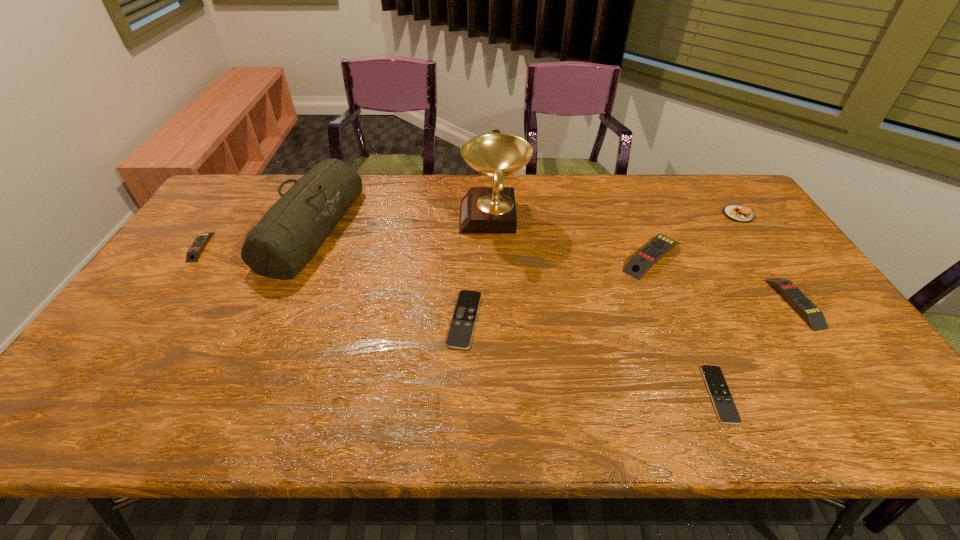
Find the location of `the farther black remote control`. the farther black remote control is located at coordinates [x=460, y=333].

Identify the location of the seventh tallest object. Image resolution: width=960 pixels, height=540 pixels. (460, 333).

Identify the location of the right black remote control. (726, 410).

This screenshot has width=960, height=540. I want to click on the shortest object, so click(726, 410).

Find the location of a particular element. Image resolution: width=960 pixels, height=540 pixels. vacant space located 0.100m on the front-facing side of the tallest object is located at coordinates (430, 217).

At what (x,y) coordinates should I click in order to perform the action: click on vacant space located on the front-facing side of the tallest object. Please return your answer as a coordinate pair (x, y). The width and height of the screenshot is (960, 540). Looking at the image, I should click on (439, 217).

Locate an element on the screen. Image resolution: width=960 pixels, height=540 pixels. vacant space located on the front-facing side of the tallest object is located at coordinates (366, 217).

You are a GUI agent. You are given a task and a screenshot of the screen. Output one action in this format:
    pyautogui.click(x=<x>, y=<y>)
    Task: Click on the free space located on the right of the olive duffel bag
    Image resolution: width=960 pixels, height=540 pixels.
    Given the screenshot: What is the action you would take?
    pyautogui.click(x=368, y=228)

In order to click on vacant space situated 0.260m on the front of the third tallest object in this screenshot , I will do `click(784, 279)`.

At what (x,y) coordinates should I click in order to perform the action: click on vacant space situated 0.190m on the back of the biggest yellow remote control. Please return your answer as a coordinate pair (x, y). The width and height of the screenshot is (960, 540). Looking at the image, I should click on (628, 200).